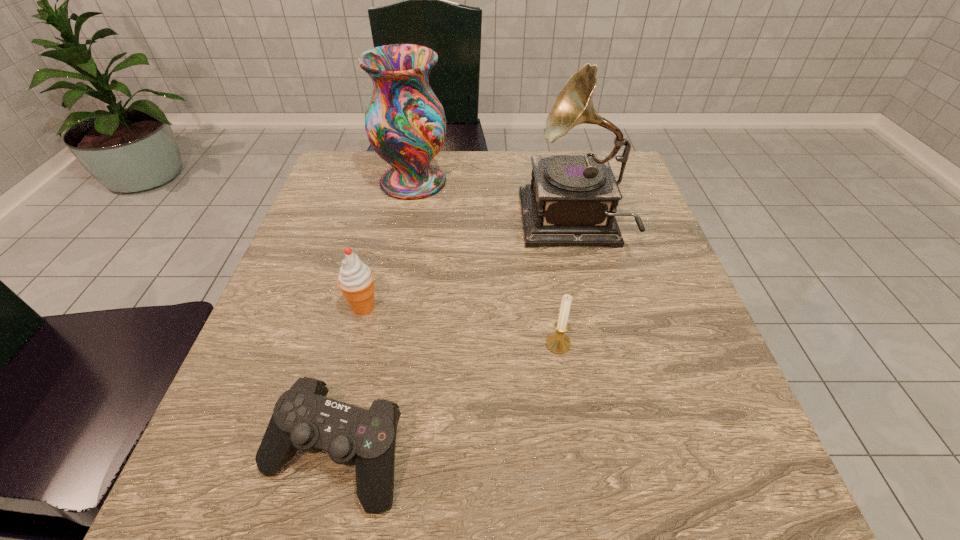
Find the location of `vacant space located on the horn of the record player`. vacant space located on the horn of the record player is located at coordinates (432, 225).

Where is `vacant space situated 0.140m on the front of the vase`? vacant space situated 0.140m on the front of the vase is located at coordinates (402, 240).

This screenshot has height=540, width=960. Find the location of `free space located 0.080m on the front of the third farthest object`. free space located 0.080m on the front of the third farthest object is located at coordinates (351, 356).

This screenshot has width=960, height=540. I want to click on vacant space situated on the right of the fourth farthest object, so click(x=627, y=344).

Locate an element on the screen. blank space located on the right of the shortest object is located at coordinates (506, 455).

Image resolution: width=960 pixels, height=540 pixels. In order to click on record player located in the far edge section of the desktop in this screenshot , I will do `click(572, 200)`.

Locate an element on the screen. The height and width of the screenshot is (540, 960). vase that is at the far edge is located at coordinates coord(405,122).

The width and height of the screenshot is (960, 540). Identify the location of object that is at the near edge. (304, 419).

Where is `vase present at the left edge`? The width and height of the screenshot is (960, 540). vase present at the left edge is located at coordinates point(405,122).

The height and width of the screenshot is (540, 960). In order to click on icecream at the left edge in this screenshot , I will do `click(356, 280)`.